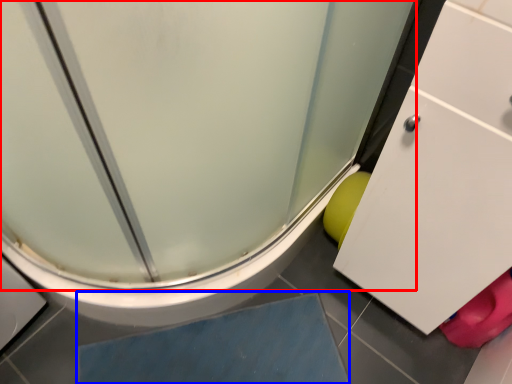
Question: Which point is closer to the camera, screen door (highlighted by a red box) or slate (highlighted by a blue box)?

Choices:
 (A) screen door
 (B) slate

Answer: (A)